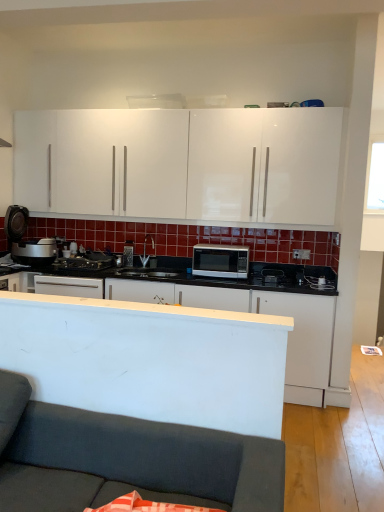
Question: Is white matte microwave at center, which is counted as the first cabinetry, starting from the bottom, next to dark gray fabric couch at lower left?

Choices:
 (A) no
 (B) yes

Answer: (A)

Question: Is white matte microwave at center, the second cabinetry from the top, aimed at dark gray fabric couch at lower left?

Choices:
 (A) no
 (B) yes

Answer: (B)

Question: Does white matte microwave at center, the second cabinetry from the top, have a lesser width compared to dark gray fabric couch at lower left?

Choices:
 (A) yes
 (B) no

Answer: (A)

Question: Is the depth of white matte microwave at center, which is counted as the first cabinetry, starting from the bottom, less than that of dark gray fabric couch at lower left?

Choices:
 (A) no
 (B) yes

Answer: (A)

Question: Is white matte microwave at center, which is counted as the first cabinetry, starting from the bottom, positioned behind dark gray fabric couch at lower left?

Choices:
 (A) yes
 (B) no

Answer: (A)

Question: Can you confirm if white matte microwave at center, the second cabinetry from the top, is positioned to the left of dark gray fabric couch at lower left?

Choices:
 (A) no
 (B) yes

Answer: (A)

Question: From the image's perspective, does white matte microwave at center, the second cabinetry from the top, appear higher than satin silver microwave at center?

Choices:
 (A) no
 (B) yes

Answer: (A)

Question: Is white matte microwave at center, which is counted as the first cabinetry, starting from the bottom, oriented away from satin silver microwave at center?

Choices:
 (A) yes
 (B) no

Answer: (B)

Question: Is white matte microwave at center, the second cabinetry from the top, positioned behind satin silver microwave at center?

Choices:
 (A) yes
 (B) no

Answer: (B)

Question: Are white matte microwave at center, which is counted as the first cabinetry, starting from the bottom, and satin silver microwave at center far apart?

Choices:
 (A) yes
 (B) no

Answer: (B)

Question: Is white matte microwave at center, the second cabinetry from the top, shorter than satin silver microwave at center?

Choices:
 (A) no
 (B) yes

Answer: (A)

Question: Is white matte microwave at center, which is counted as the first cabinetry, starting from the bottom, not within satin silver microwave at center?

Choices:
 (A) no
 (B) yes

Answer: (B)

Question: Is dark gray fabric couch at lower left oriented towards transparent glass window at upper right?

Choices:
 (A) yes
 (B) no

Answer: (B)